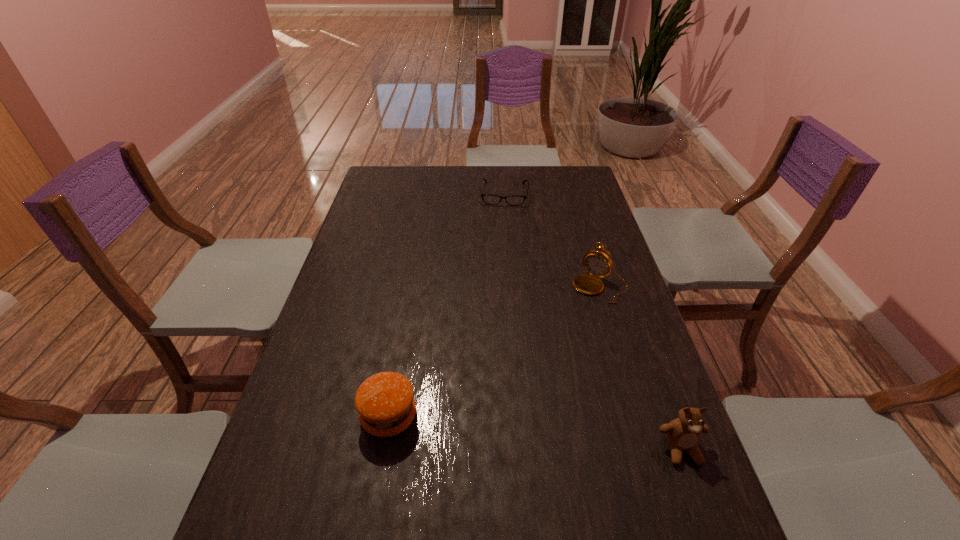
Find the location of a particular element. vacant space on the desktop that is between the patty and the teddy bear and is positioned on the face of the pocket watch is located at coordinates (494, 428).

This screenshot has height=540, width=960. Identify the location of free space on the desktop that is between the leftmost object and the teddy bear and is positioned on the front-facing side of the shortest object. (489, 428).